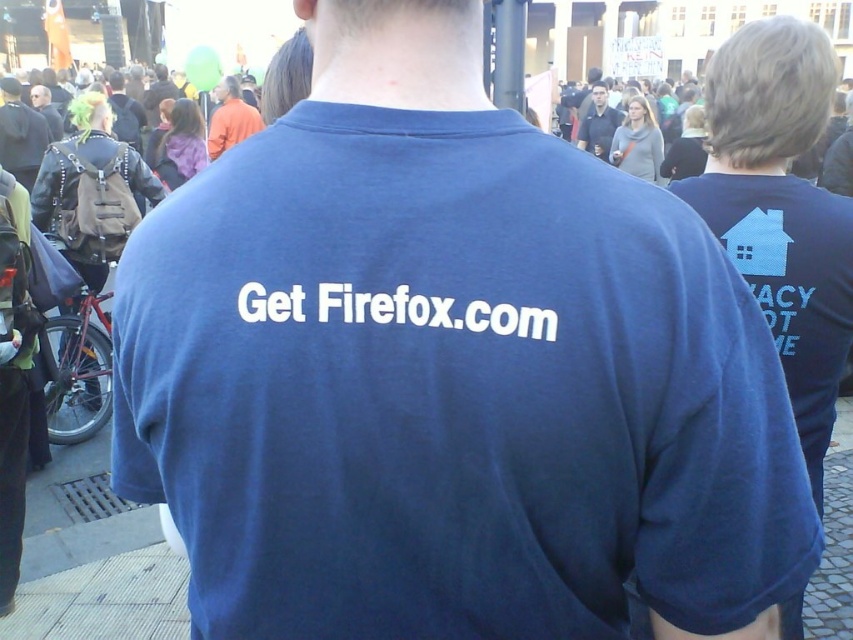
You are at an outdoor event and need to locate your friend who is wearing a dark blue shirt at center. There is also a matte black backpack at left nearby. Which object is closer to your current position if you see both items in your field of view?

The matte black backpack at left is closer because it is positioned to the left of the dark blue shirt at center, meaning it is nearer to your current position.

You are standing in the crowd and want to locate the orange cotton shirt at upper center. Based on the coordinates provided, can you estimate its position relative to the two people in blue tshirts?

The orange cotton shirt at upper center is located at coordinates point (230, 118), which places it above and to the left of the two people in blue tshirts.